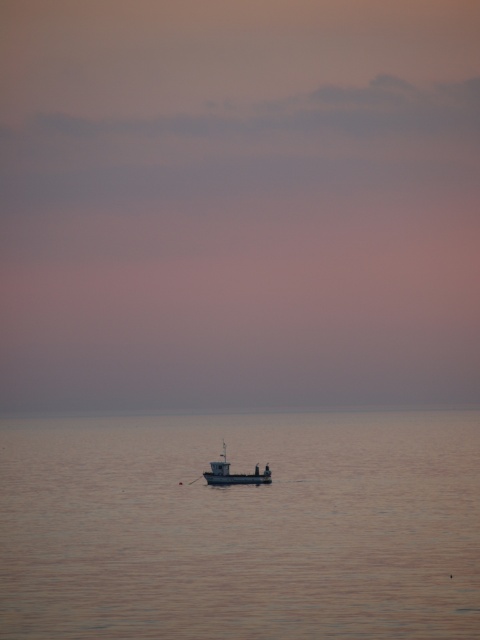
Question: Which object is farther from the camera taking this photo?

Choices:
 (A) metallic gray boat at center
 (B) smooth water at center

Answer: (A)

Question: Which object is closer to the camera taking this photo?

Choices:
 (A) metallic gray boat at center
 (B) smooth water at center

Answer: (B)

Question: Which object appears farthest from the camera in this image?

Choices:
 (A) smooth water at center
 (B) metallic gray boat at center

Answer: (B)

Question: Where is smooth water at center located in relation to metallic gray boat at center in the image?

Choices:
 (A) below
 (B) above

Answer: (A)

Question: Does smooth water at center appear on the left side of metallic gray boat at center?

Choices:
 (A) no
 (B) yes

Answer: (B)

Question: Is smooth water at center above metallic gray boat at center?

Choices:
 (A) no
 (B) yes

Answer: (A)